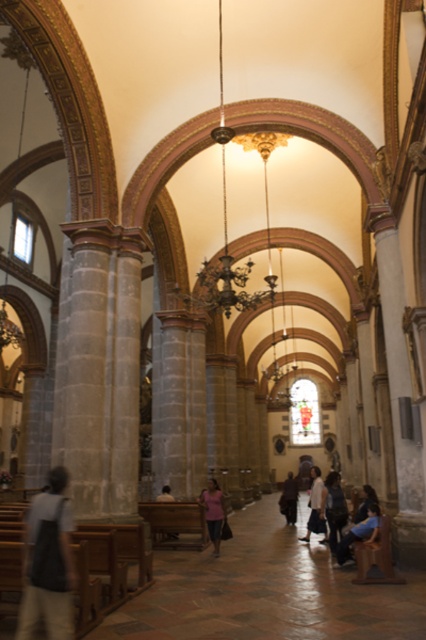
You are standing in the grand church and notice two items on the floor. The blue denim jeans at lower center and the white cotton shirt at center. Which item is closer to the ceiling?

The blue denim jeans at lower center is located above the white cotton shirt at center, so it is closer to the ceiling.

From the picture: You are standing in the grand church and need to move from your current position to the exit located near the stained glass windows. You see the blue denim jeans at lower center and the white cotton shirt at center. Which item is closer to the exit?

The blue denim jeans at lower center and white cotton shirt at center are 16.00 meters apart from each other. Since the exit is near the stained glass windows at the far end of the nave, the white cotton shirt at center is closer to the exit than the blue denim jeans at lower center.

You are standing in the grand church and want to pick up both items. Since the dark blue jeans at center and the dark brown leather jacket at center are both at the center, how can you tell which one is closer to you?

The dark blue jeans at center is in front of the dark brown leather jacket at center, so the dark blue jeans at center is closer to you.